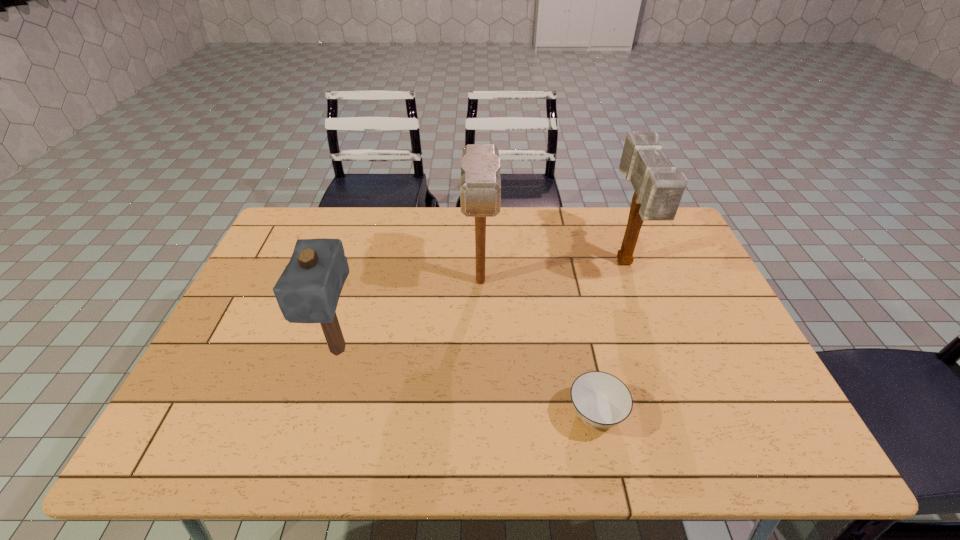
Where is `vacant point located between the rightmost mallet and the third farthest object`? vacant point located between the rightmost mallet and the third farthest object is located at coordinates (481, 307).

The width and height of the screenshot is (960, 540). I want to click on free space that is in between the rightmost object and the nearest object, so click(x=610, y=339).

Where is `free space that is in between the second object from left to right and the leftmost mallet`? This screenshot has width=960, height=540. free space that is in between the second object from left to right and the leftmost mallet is located at coordinates (409, 316).

Image resolution: width=960 pixels, height=540 pixels. I want to click on free space between the shortest mallet and the second mallet from right to left, so click(x=409, y=316).

Find the location of a particular element. free space between the nearest mallet and the rightmost object is located at coordinates (481, 307).

Identify the location of vacant area that lies between the soup bowl and the rightmost mallet. Image resolution: width=960 pixels, height=540 pixels. (610, 339).

Locate which object is the third closest to the leftmost mallet. Please provide its 2D coordinates. Your answer should be formatted as a tuple, i.e. [(x, y)], where the tuple contains the x and y coordinates of a point satisfying the conditions above.

[(658, 189)]

The height and width of the screenshot is (540, 960). What are the coordinates of `object that stands as the third closest to the leftmost mallet` in the screenshot? It's located at (x=658, y=189).

Select which mallet is the second closest to the leftmost object. Please provide its 2D coordinates. Your answer should be formatted as a tuple, i.e. [(x, y)], where the tuple contains the x and y coordinates of a point satisfying the conditions above.

[(658, 189)]

In order to click on mallet that stands as the second closest to the third object from right to left in this screenshot , I will do `click(658, 189)`.